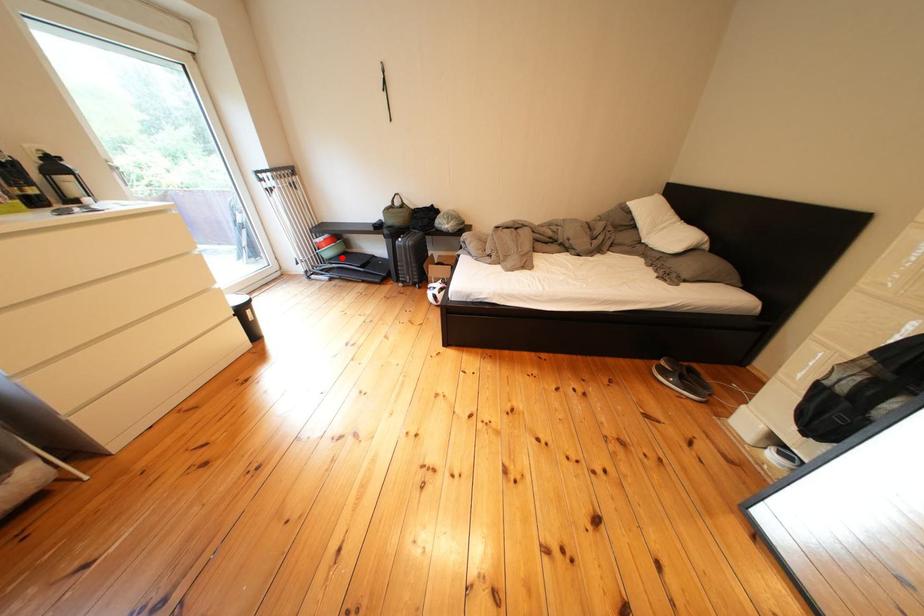
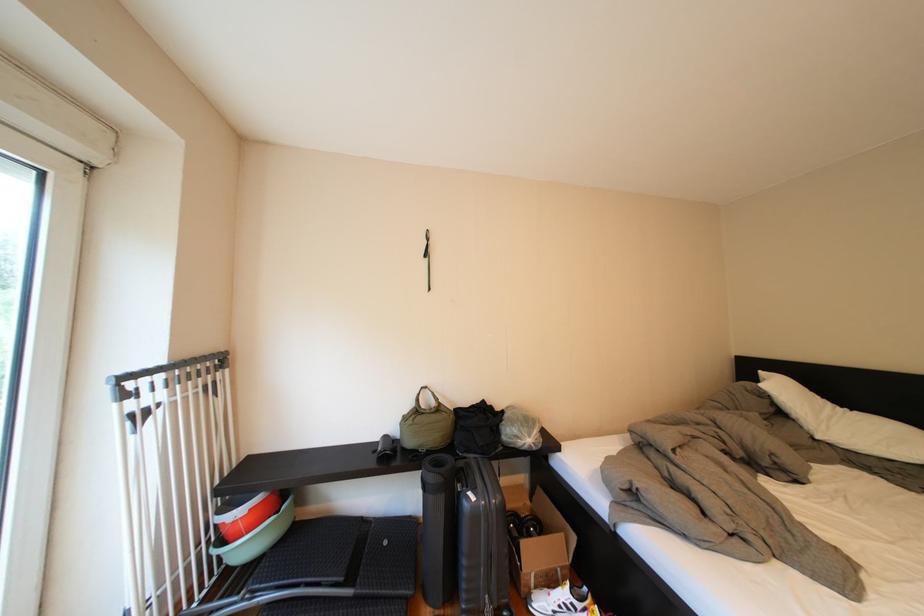
Question: I am providing you with two images of the same scene from different viewpoints. Image1 has a red point marked. In image2, the corresponding 3D location appears at what relative position? Reply with the corresponding letter.

Choices:
 (A) Closer
 (B) Farther

Answer: (B)